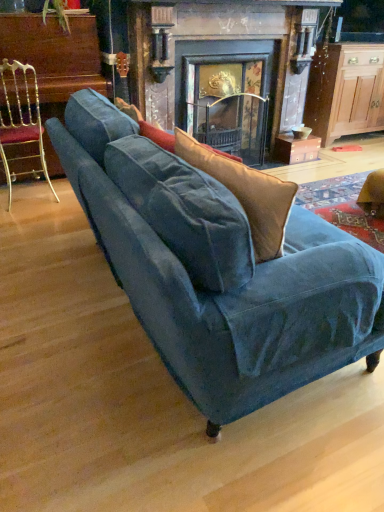
Question: In the image, is wooden cabinet at right on the left side or the right side of dark gray stone fireplace at center?

Choices:
 (A) left
 (B) right

Answer: (B)

Question: Considering the positions of wooden cabinet at right and dark gray stone fireplace at center in the image, is wooden cabinet at right wider or thinner than dark gray stone fireplace at center?

Choices:
 (A) thin
 (B) wide

Answer: (A)

Question: Which is nearer to the wooden cabinet at right?

Choices:
 (A) dark gray stone fireplace at center
 (B) velvet blue couch at center
 (C) gold metallic chair at left

Answer: (A)

Question: Which is farther from the gold metallic chair at left?

Choices:
 (A) wooden cabinet at right
 (B) dark gray stone fireplace at center
 (C) velvet blue couch at center

Answer: (A)